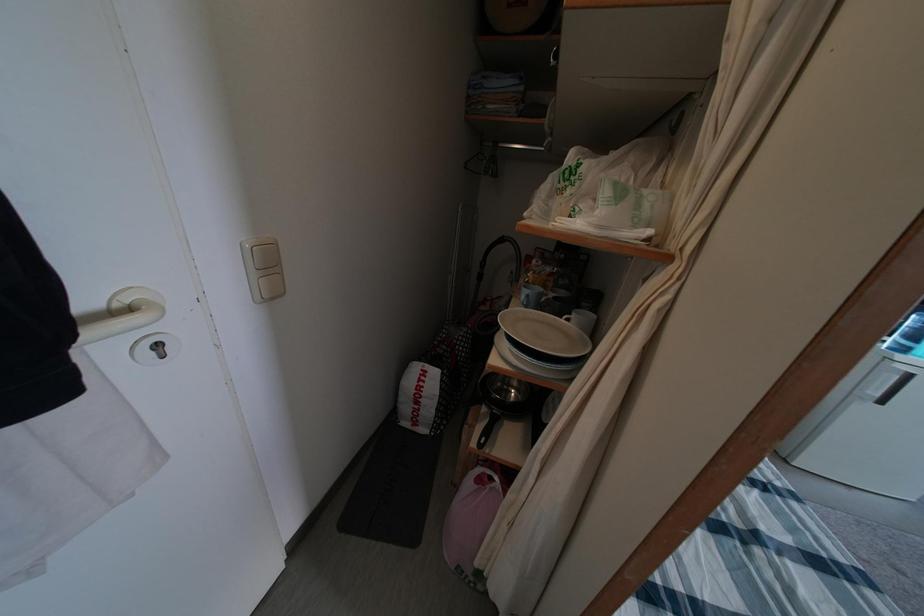
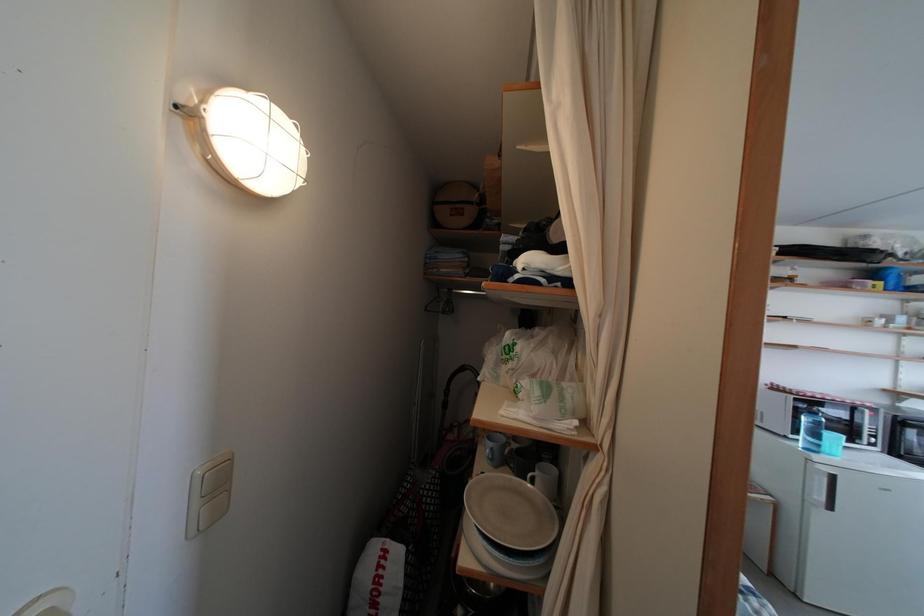
Question: Based on the continuous images, in which direction is the camera rotating? Reply with the corresponding letter.

Choices:
 (A) Left
 (B) Right
 (C) Up
 (D) Down

Answer: (C)